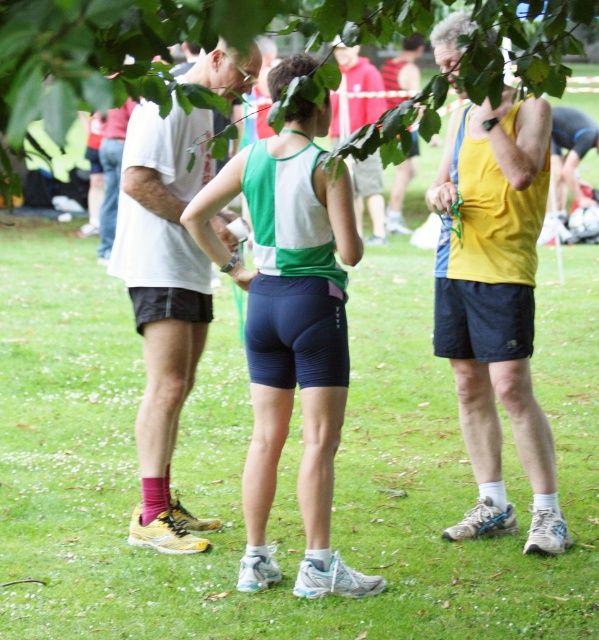
Question: Can you confirm if matte green and white tank top at center is positioned below yellow matte tank top at center?

Choices:
 (A) no
 (B) yes

Answer: (B)

Question: Does green leafy tree at upper center have a smaller size compared to yellow matte tank top at center?

Choices:
 (A) yes
 (B) no

Answer: (B)

Question: Which of these objects is positioned farthest from the matte green and white tank top at center?

Choices:
 (A) green leafy tree at upper center
 (B) green jersey at center

Answer: (B)

Question: Is maroon sock at left below green jersey at center?

Choices:
 (A) yes
 (B) no

Answer: (A)

Question: Which object appears closest to the camera in this image?

Choices:
 (A) matte green and white tank top at center
 (B) maroon sock at left

Answer: (A)

Question: Which object appears closest to the camera in this image?

Choices:
 (A) maroon sock at left
 (B) green grass at center
 (C) yellow matte tank top at center

Answer: (C)